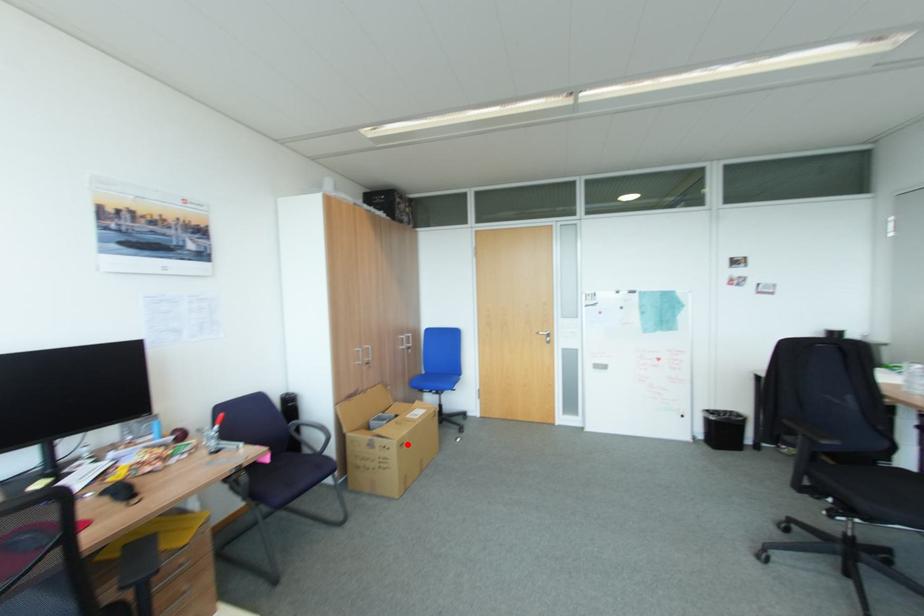
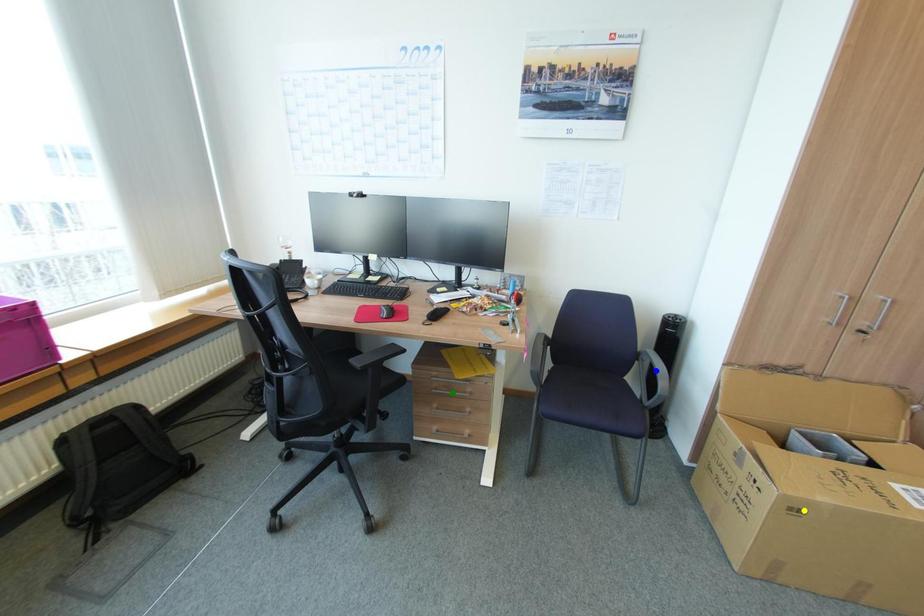
Question: I am providing you with two images of the same scene from different viewpoints. A red point is marked on the first image. You are given multiple points on the second image. Which spot in image 2 lines up with the point in image 1?

Choices:
 (A) yellow point
 (B) green point
 (C) blue point

Answer: (A)